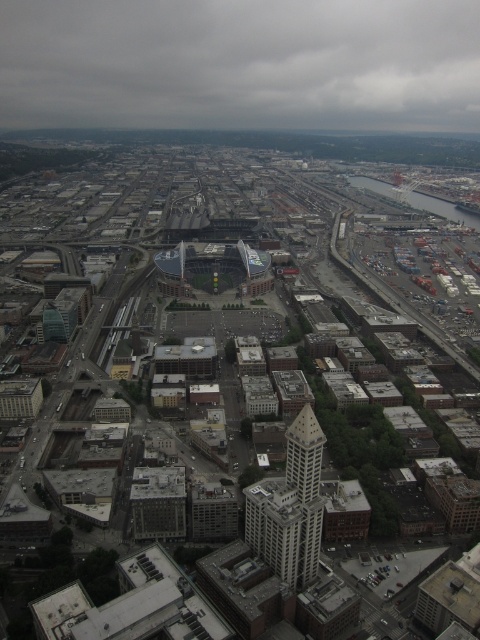
You are a city planner reviewing an aerial map of the city. You need to determine the coordinates of the gray cloudy sky at upper center for a weather analysis report. What are its coordinates?

The gray cloudy sky at upper center is located at coordinates point (x=240, y=64).

You are a pilot flying a small airplane and need to land at the airport located to the east of the city. Your current position is above the gray cloudy sky at upper center. Which direction should you head to reach the white stone tower at center before landing?

The gray cloudy sky at upper center is positioned over the white stone tower at center, so you should head south to reach the white stone tower at center before landing.